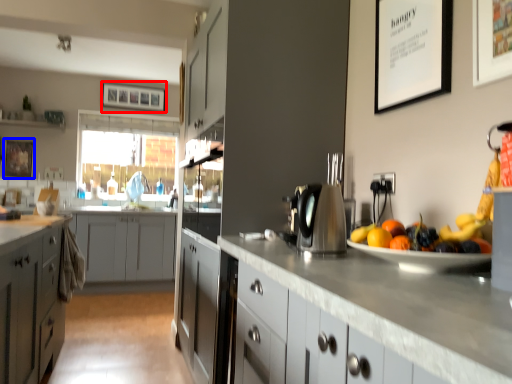
Question: Which object appears closest to the camera in this image, picture frame (highlighted by a red box) or picture frame (highlighted by a blue box)?

Choices:
 (A) picture frame
 (B) picture frame

Answer: (B)